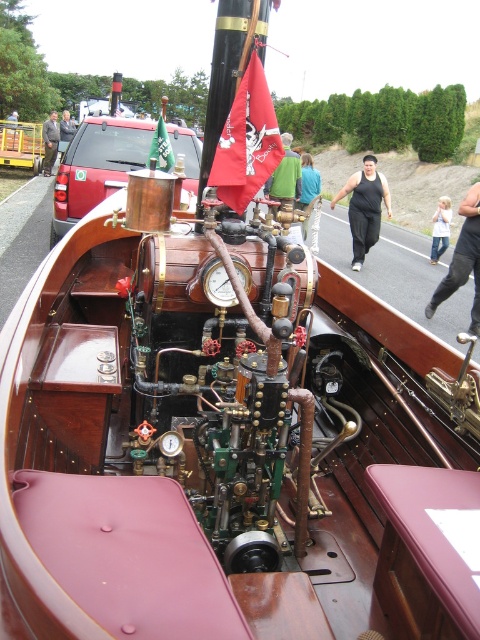
Between jeans at right and dark blue jeans at center, which one appears on the left side from the viewer's perspective?

From the viewer's perspective, dark blue jeans at center appears more on the left side.

Can you confirm if jeans at right is thinner than dark blue jeans at center?

No, jeans at right is not thinner than dark blue jeans at center.

Does point (433, 228) come closer to viewer compared to point (307, 221)?

No, it is behind (307, 221).

Where is `jeans at right`? jeans at right is located at coordinates (441, 228).

Can you confirm if dark blue jeans at center is positioned below blue denim jeans at center?

Indeed, dark blue jeans at center is positioned under blue denim jeans at center.

The image size is (480, 640). I want to click on dark blue jeans at center, so click(308, 180).

Does black fabric pants at center appear on the right side of matte brass gauge at center?

Indeed, black fabric pants at center is positioned on the right side of matte brass gauge at center.

Can you confirm if black fabric pants at center is positioned below matte brass gauge at center?

Incorrect, black fabric pants at center is not positioned below matte brass gauge at center.

Is point (456, 260) in front of point (214, 259)?

That is False.

At what (x,y) coordinates should I click in order to perform the action: click on black fabric pants at center. Please return your answer as a coordinate pair (x, y). The width and height of the screenshot is (480, 640). Looking at the image, I should click on (463, 260).